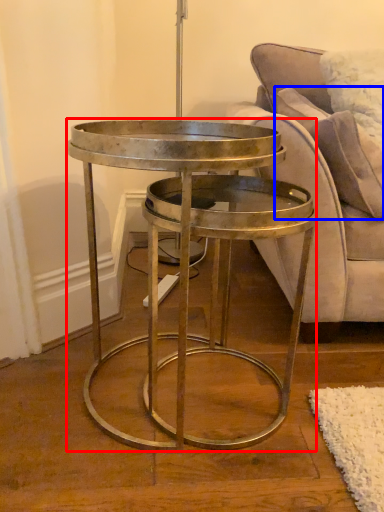
Question: Which object appears farthest to the camera in this image, coffee table (highlighted by a red box) or pillow (highlighted by a blue box)?

Choices:
 (A) coffee table
 (B) pillow

Answer: (B)